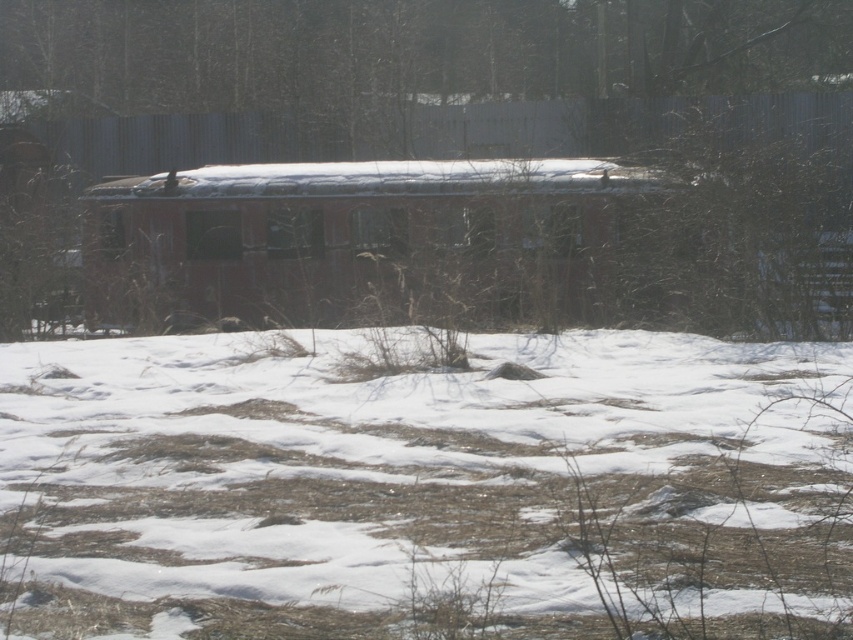
You are standing in the snowy landscape and want to know if the white fluffy snow at lower center is taller than the brown textured fence at upper center. Based on the scene, can you determine which one is taller?

The white fluffy snow at lower center is not as tall as the brown textured fence at upper center, so the fence is taller.

You are a hiker trying to cross the area between the white fluffy snow at lower center and the rusty metal train car at center. The path is narrow. Can you pass through if your backpack is 1 meter wide?

The white fluffy snow at lower center is narrower than the rusty metal train car at center. Since the path between them is narrower than 1 meter, your backpack might not fit through.

You are standing in the snowy landscape and want to walk from the white fluffy snow at lower center to the brown textured fence at upper center. Which direction should you move?

You should move upward towards the brown textured fence at upper center since the white fluffy snow at lower center is positioned under it.